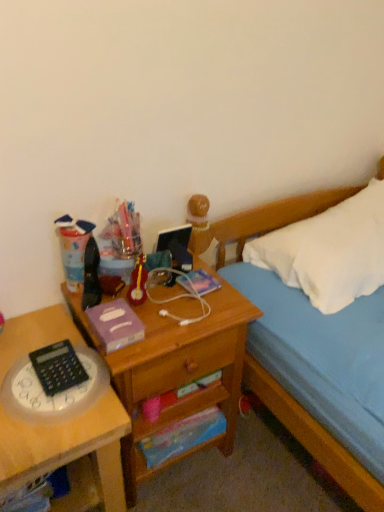
Find the location of a particular element. vacant area on the back side of black plastic calculator at lower left is located at coordinates (39, 327).